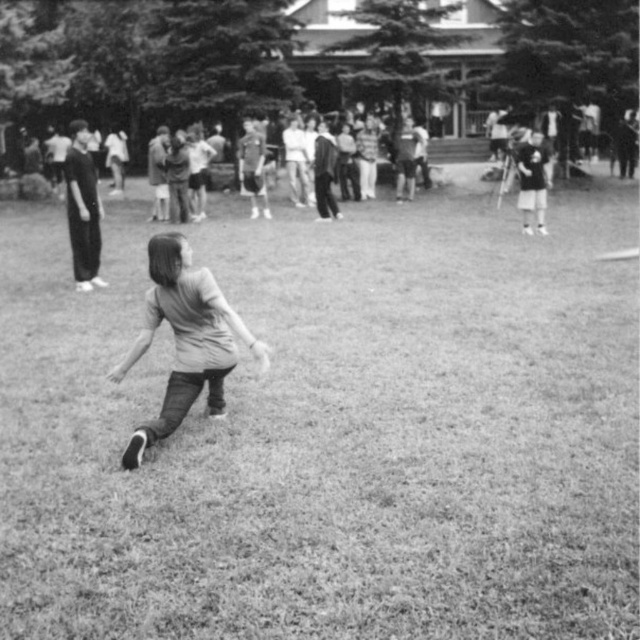
Question: Which of these objects is positioned closest to the smooth gray shirt at center?

Choices:
 (A) smooth leather jacket at upper center
 (B) grassy at center

Answer: (B)

Question: Can you confirm if smooth gray shirt at center is thinner than dark gray suit at center?

Choices:
 (A) yes
 (B) no

Answer: (B)

Question: Can you confirm if grassy at center is wider than smooth leather jacket at upper center?

Choices:
 (A) yes
 (B) no

Answer: (A)

Question: Among these points, which one is farthest from the camera?

Choices:
 (A) (x=77, y=172)
 (B) (x=147, y=326)

Answer: (A)

Question: Based on their relative distances, which object is farther from the smooth gray shirt at center?

Choices:
 (A) smooth leather jacket at upper center
 (B) grassy at center
 (C) dark gray suit at center
 (D) dark gray pants at left

Answer: (A)

Question: Can you confirm if dark gray suit at center is smaller than smooth leather jacket at upper center?

Choices:
 (A) no
 (B) yes

Answer: (B)